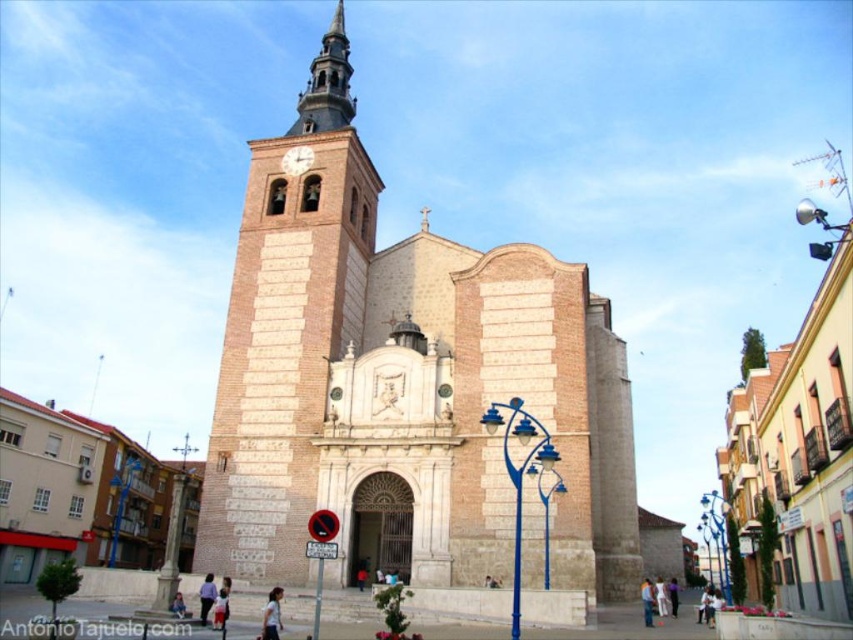
You are standing in front of the church and want to take a photo of the light blue fabric shirt at lower center with the brown stone clock tower at center in the background. Is the clock tower positioned to the left or right side of the shirt in the image?

The brown stone clock tower at center is to the left of the light blue fabric shirt at lower center in the image.

You are standing in front of the historic church and want to take a photo of a specific point marked at coordinates point (299,156). Your camera has a maximum focus range of 70 meters. Will the point be in focus?

The distance of point (299,156) from viewer is 69.15 meters, which is within the camera maximum focus range of 70 meters. Therefore, the point will be in focus.